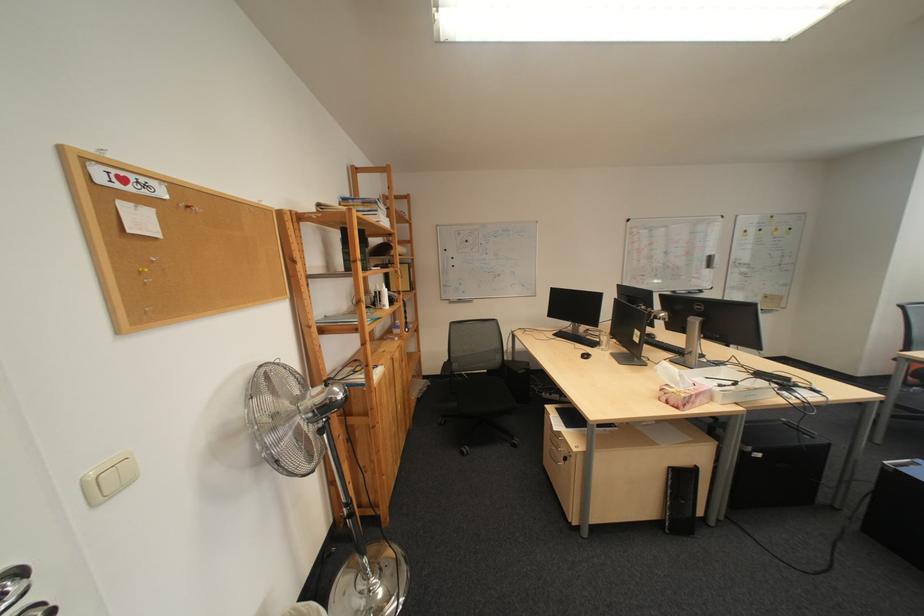
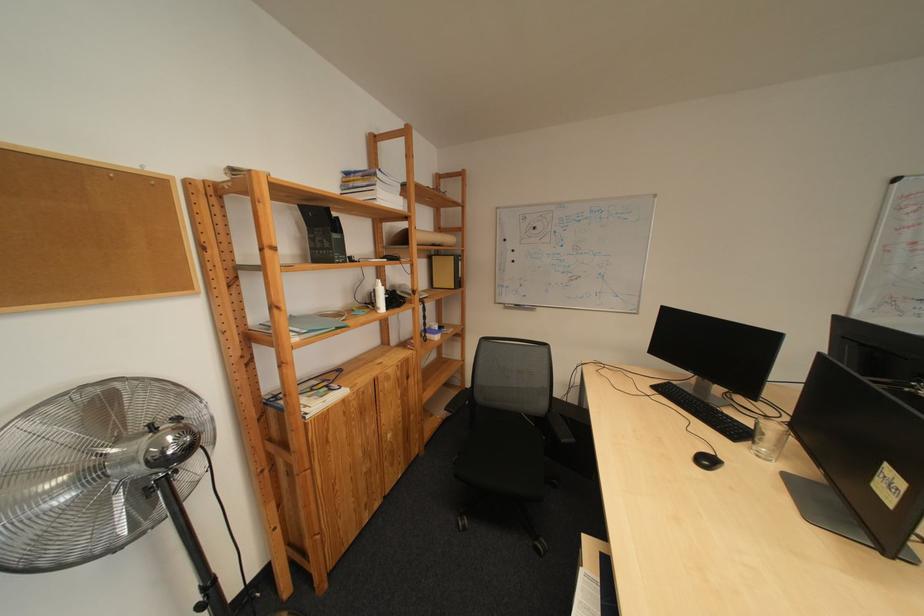
The images are taken continuously from a first-person perspective. In which direction are you moving?

The movement direction of the cameraman is right, forward.